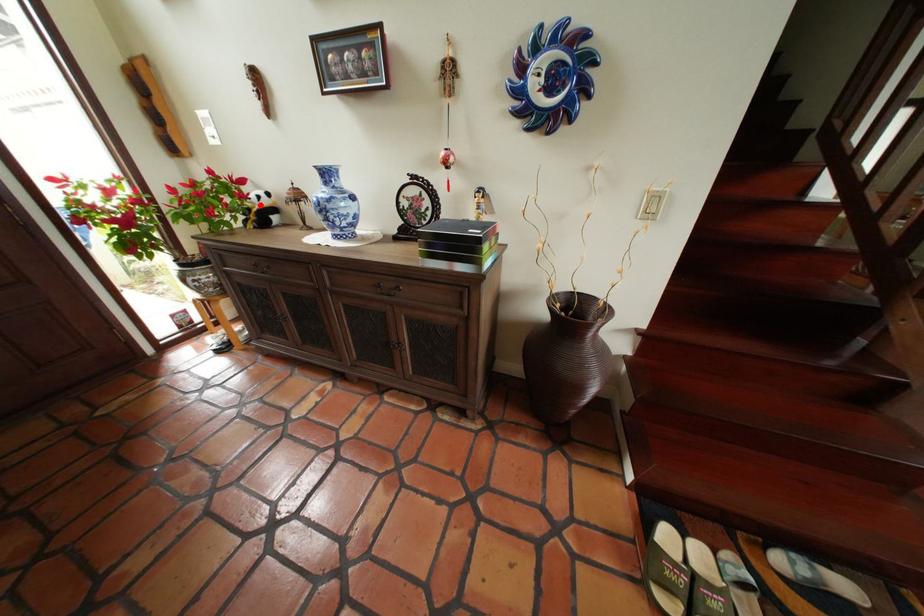
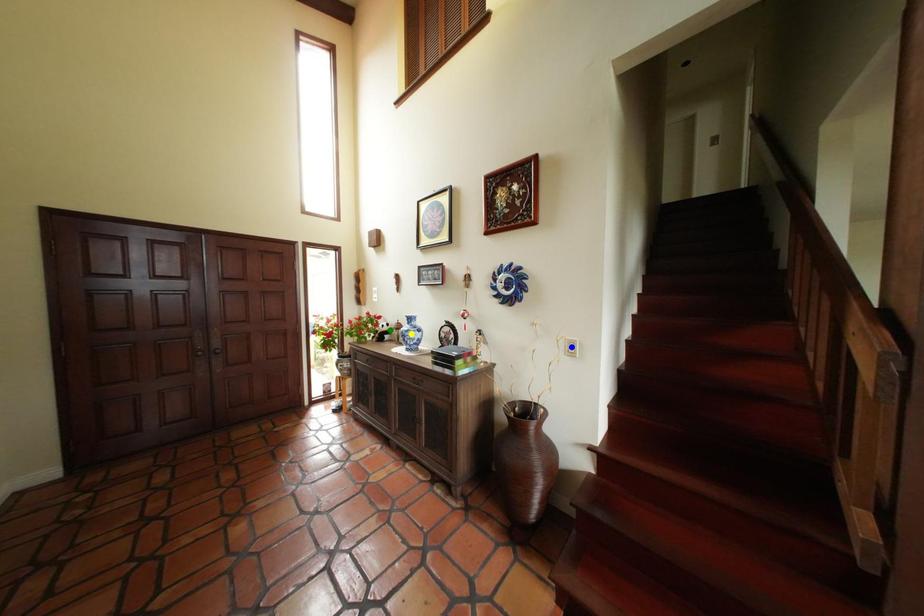
Question: I am providing you with two images of the same scene from different viewpoints. A red point is marked on the first image. You are given multiple points on the second image. Which point in image 2 is actually the same real-world point as the red point in image 1?

Choices:
 (A) yellow point
 (B) green point
 (C) blue point

Answer: (B)